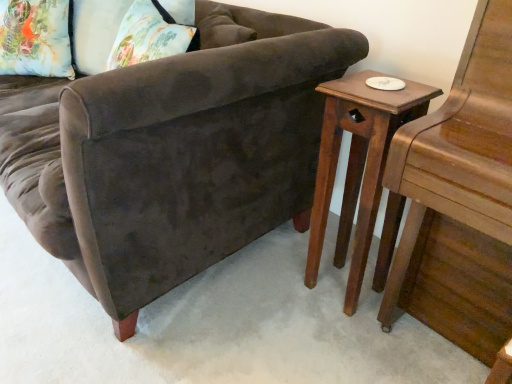
Identify the location of free point below wooden side table at right (from a real-world perspective). The width and height of the screenshot is (512, 384). pos(338,285).